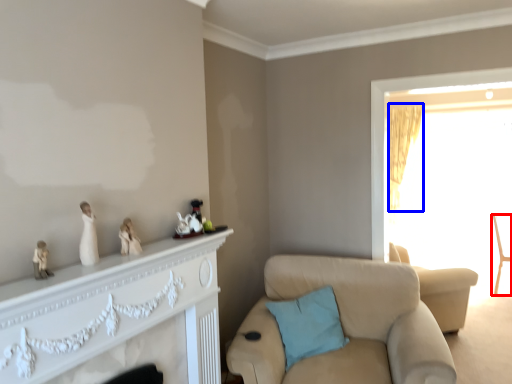
Question: Among these objects, which one is nearest to the camera, chair (highlighted by a red box) or curtain (highlighted by a blue box)?

Choices:
 (A) chair
 (B) curtain

Answer: (A)